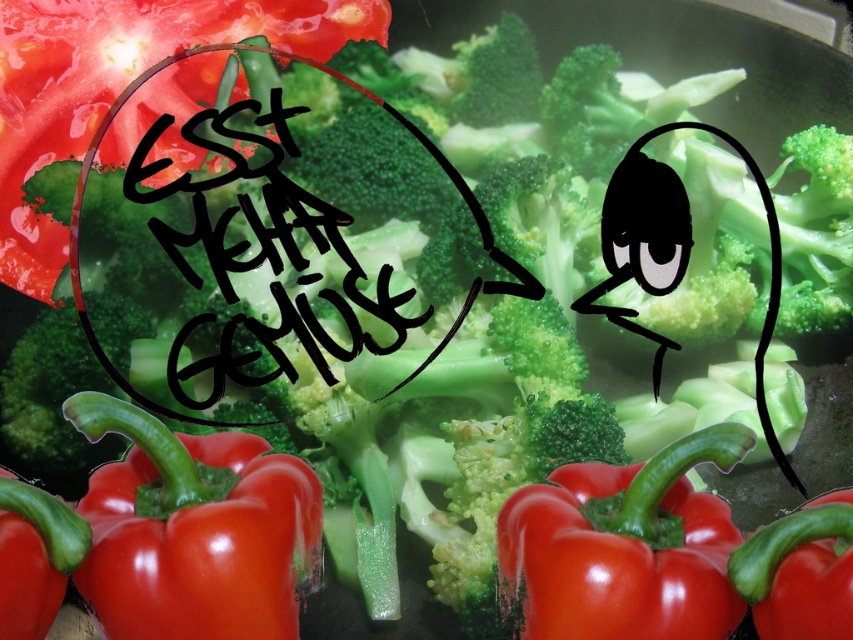
Which is more to the left, glossy red bell pepper at center or smooth red bell pepper at lower right?

glossy red bell pepper at center is more to the left.

The width and height of the screenshot is (853, 640). Describe the element at coordinates (624, 547) in the screenshot. I see `glossy red bell pepper at center` at that location.

Is point (502, 545) closer to viewer compared to point (827, 579)?

No, it is behind (827, 579).

I want to click on glossy red bell pepper at center, so click(x=624, y=547).

Who is positioned more to the left, shiny red bell pepper at lower left or smooth red bell pepper at lower right?

shiny red bell pepper at lower left

Is shiny red bell pepper at lower left taller than smooth red bell pepper at lower right?

Yes.

Between point (108, 481) and point (821, 611), which one is positioned behind?

Positioned behind is point (108, 481).

Where is `shiny red bell pepper at lower left`? The image size is (853, 640). shiny red bell pepper at lower left is located at coordinates (193, 531).

Is smooth red bell pepper at lower right positioned behind smooth red bell pepper at lower left?

Yes.

Which of these two, smooth red bell pepper at lower right or smooth red bell pepper at lower left, stands taller?

Standing taller between the two is smooth red bell pepper at lower left.

Locate an element on the screen. Image resolution: width=853 pixels, height=640 pixels. smooth red bell pepper at lower right is located at coordinates (799, 572).

The image size is (853, 640). Identify the location of smooth red bell pepper at lower right. (x=799, y=572).